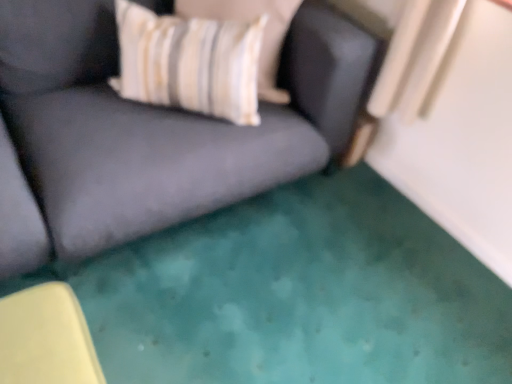
Question: Is velvet dark gray couch at center looking in the opposite direction of striped fabric pillow at upper center?

Choices:
 (A) no
 (B) yes

Answer: (B)

Question: Would you say striped fabric pillow at upper center is part of velvet dark gray couch at center's contents?

Choices:
 (A) no
 (B) yes

Answer: (B)

Question: Could you tell me if velvet dark gray couch at center is turned towards striped fabric pillow at upper center?

Choices:
 (A) no
 (B) yes

Answer: (B)

Question: From the image's perspective, is velvet dark gray couch at center on top of striped fabric pillow at upper center?

Choices:
 (A) no
 (B) yes

Answer: (A)

Question: Is the position of velvet dark gray couch at center more distant than that of striped fabric pillow at upper center?

Choices:
 (A) no
 (B) yes

Answer: (A)

Question: Is velvet dark gray couch at center smaller than striped fabric pillow at upper center?

Choices:
 (A) yes
 (B) no

Answer: (B)

Question: Is velvet dark gray couch at center wider than white striped fabric pillow at upper left?

Choices:
 (A) no
 (B) yes

Answer: (B)

Question: From the image's perspective, is velvet dark gray couch at center over white striped fabric pillow at upper left?

Choices:
 (A) yes
 (B) no

Answer: (B)

Question: Does velvet dark gray couch at center have a larger size compared to white striped fabric pillow at upper left?

Choices:
 (A) no
 (B) yes

Answer: (B)

Question: From a real-world perspective, does velvet dark gray couch at center sit lower than white striped fabric pillow at upper left?

Choices:
 (A) no
 (B) yes

Answer: (B)

Question: From the image's perspective, is velvet dark gray couch at center located beneath white striped fabric pillow at upper left?

Choices:
 (A) no
 (B) yes

Answer: (B)

Question: Can you see velvet dark gray couch at center touching white striped fabric pillow at upper left?

Choices:
 (A) no
 (B) yes

Answer: (A)

Question: From a real-world perspective, is white striped fabric pillow at upper left positioned under velvet dark gray couch at center based on gravity?

Choices:
 (A) no
 (B) yes

Answer: (A)